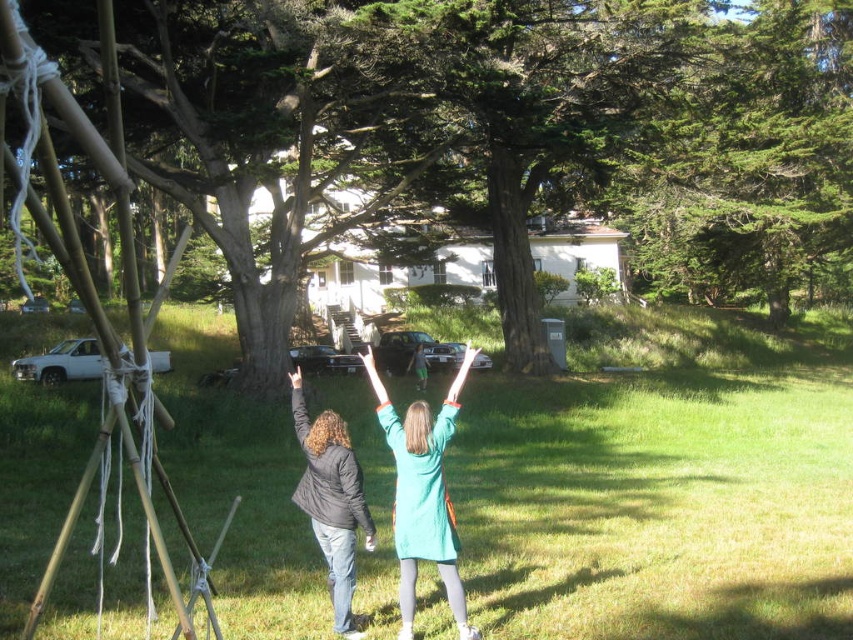
Can you confirm if green grass at center is thinner than green leafy tree at center?

No.

Which of these two, green grass at center or green leafy tree at center, stands taller?

green leafy tree at center is taller.

Is point (68, 406) more distant than point (173, 83)?

No, it is in front of (173, 83).

Identify the location of green grass at center. This screenshot has width=853, height=640. click(663, 493).

Is green leafy tree at center to the left of green matte dress at center from the viewer's perspective?

Incorrect, green leafy tree at center is not on the left side of green matte dress at center.

Is green leafy tree at center bigger than green matte dress at center?

Yes.

Where is `green leafy tree at center`? green leafy tree at center is located at coordinates (512, 125).

Measure the distance between green grass at center and camera.

A distance of 6.15 meters exists between green grass at center and camera.

Is point (599, 486) farther from viewer compared to point (331, 483)?

Yes, it is.

The image size is (853, 640). I want to click on green grass at center, so click(x=663, y=493).